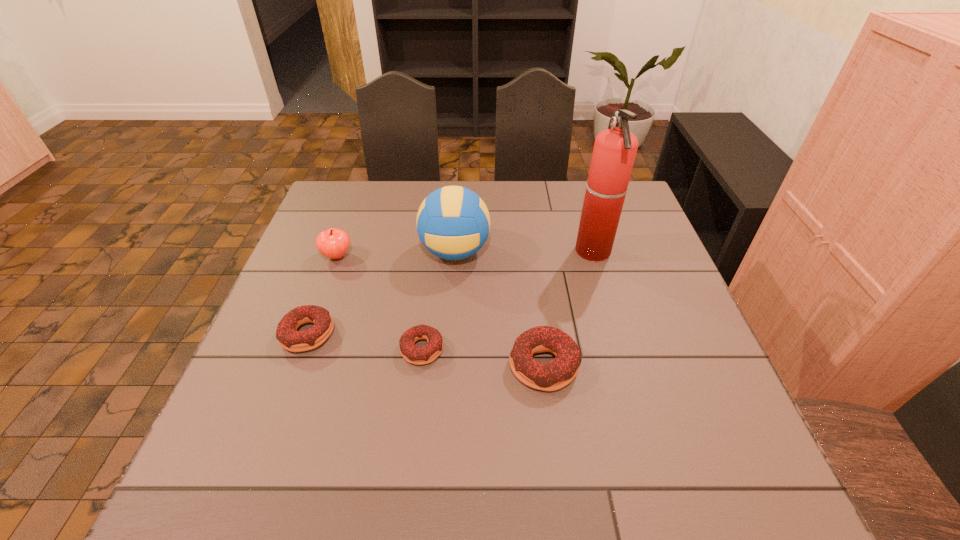
Given the evenly spaced doughnuts in the image, where should an extra doughnut be added on the right to preserve the spacing? Please point to a vacant space. Please provide its 2D coordinates. Your answer should be formatted as a tuple, i.e. [(x, y)], where the tuple contains the x and y coordinates of a point satisfying the conditions above.

[(674, 382)]